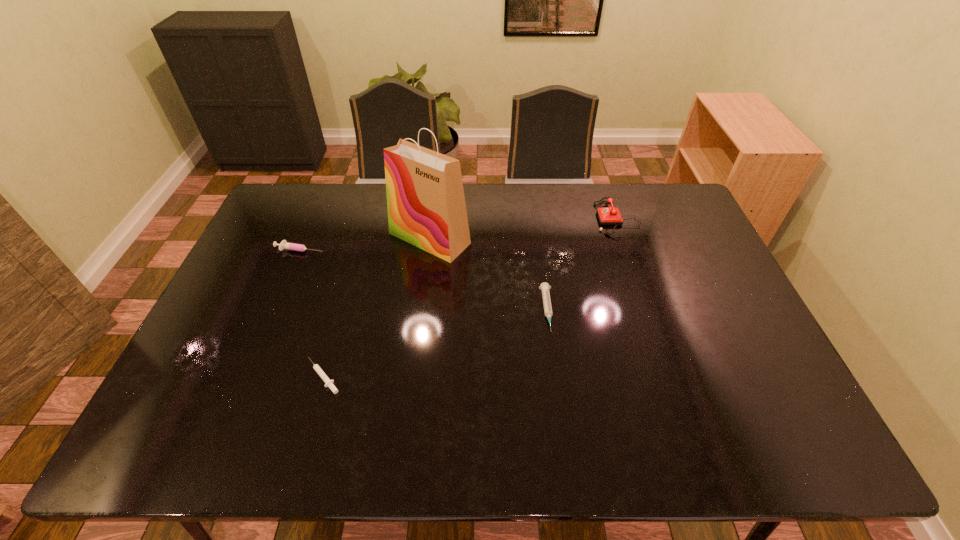
Identify the location of blank area in the image that satisfies the following two spatial constraints: 1. on the back side of the leftmost object; 2. on the left side of the third object from left to right. This screenshot has height=540, width=960. (305, 238).